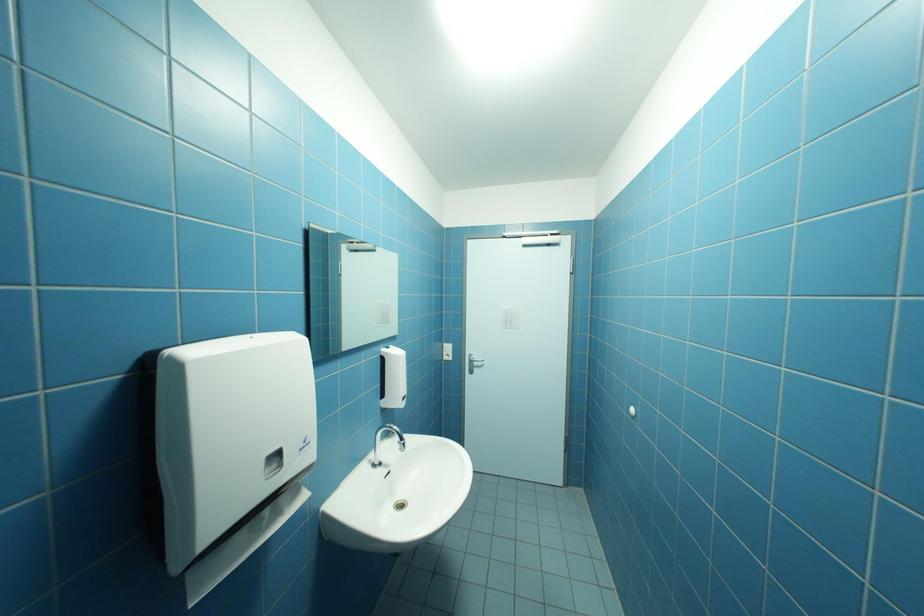
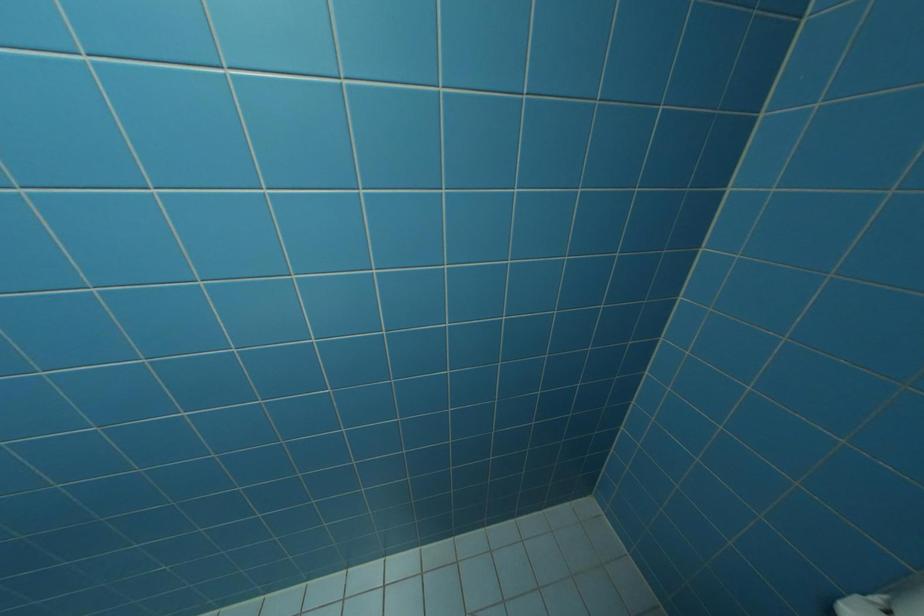
Based on the photo, first-person continuous shooting, in which direction is the camera rotating?

The rotation direction of the camera is right-down.